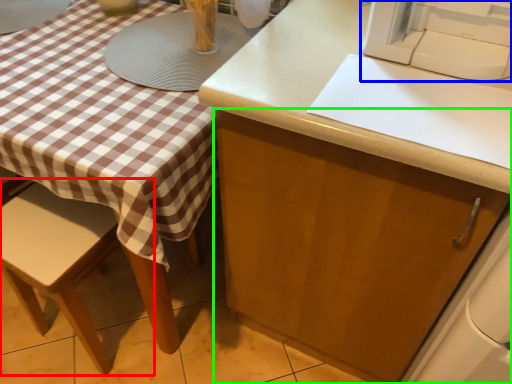
Question: Estimate the real-world distances between objects in this image. Which object is closer to chair (highlighted by a red box), sewing machine (highlighted by a blue box) or cabinetry (highlighted by a green box)?

Choices:
 (A) sewing machine
 (B) cabinetry

Answer: (B)